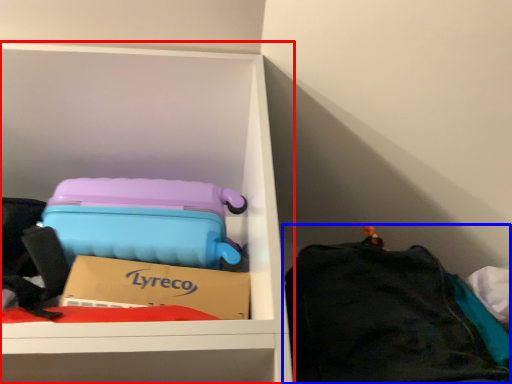
Question: Among these objects, which one is nearest to the camera, furniture (highlighted by a red box) or luggage and bags (highlighted by a blue box)?

Choices:
 (A) furniture
 (B) luggage and bags

Answer: (B)